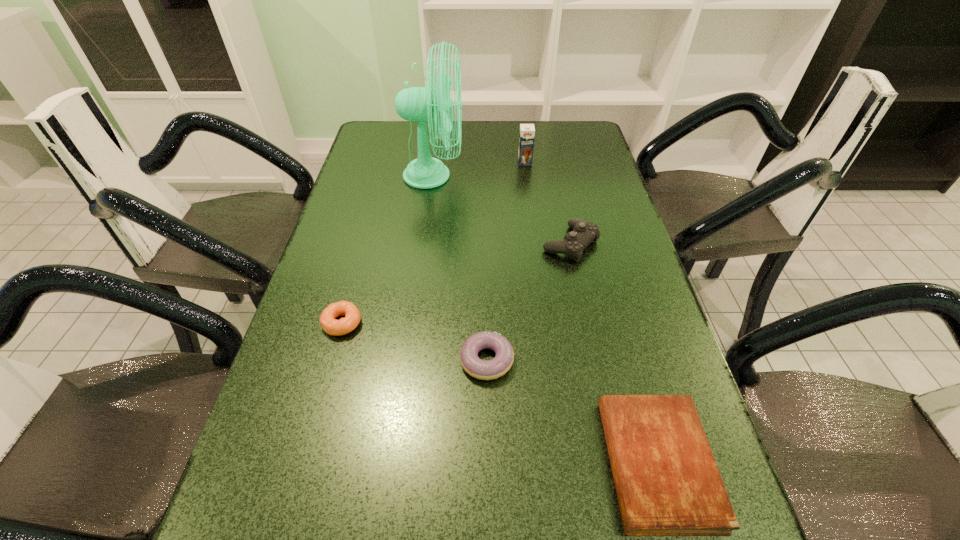
The width and height of the screenshot is (960, 540). What are the coordinates of `Bible that is positioned at the right edge` in the screenshot? It's located at (667, 481).

Find the location of `object that is at the far left corner`. object that is at the far left corner is located at coordinates (417, 104).

This screenshot has width=960, height=540. Identify the location of free space at the far edge. (484, 153).

Find the location of a particular element. Image resolution: width=960 pixels, height=540 pixels. free space at the left edge of the desktop is located at coordinates (379, 160).

You are a GUI agent. You are given a task and a screenshot of the screen. Output one action in this format:
    pyautogui.click(x=<x>, y=<y>)
    Task: Click on the vacant position at the right edge of the desktop
    Image resolution: width=960 pixels, height=540 pixels.
    Given the screenshot: What is the action you would take?
    pyautogui.click(x=625, y=232)

You are a GUI agent. You are given a task and a screenshot of the screen. Output one action in this format:
    pyautogui.click(x=<x>, y=<y>)
    Task: Click on the vacant space at the far left corner
    This screenshot has width=960, height=540.
    Given the screenshot: What is the action you would take?
    pyautogui.click(x=382, y=146)

The height and width of the screenshot is (540, 960). Find the location of `free area in between the second object from left to right and the chocolate milk`. free area in between the second object from left to right and the chocolate milk is located at coordinates (479, 169).

Locate an element on the screen. This screenshot has width=960, height=540. empty location between the fifth shortest object and the second object from left to right is located at coordinates (479, 169).

Where is `free area in between the control and the Bible`? The width and height of the screenshot is (960, 540). free area in between the control and the Bible is located at coordinates 613,354.

Locate an element on the screen. The image size is (960, 540). empty location between the fourth shortest object and the left doughnut is located at coordinates (456, 284).